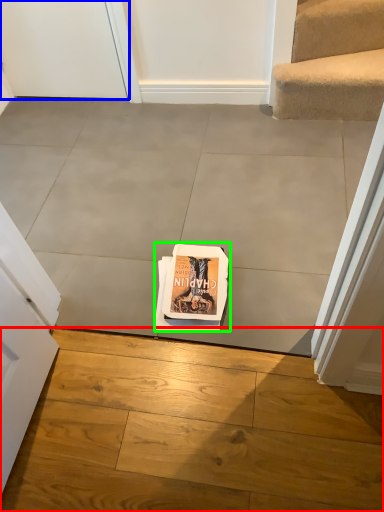
Question: Estimate the real-world distances between objects in this image. Which object is closer to concrete (highlighted by a red box), door (highlighted by a blue box) or paperback book (highlighted by a green box)?

Choices:
 (A) door
 (B) paperback book

Answer: (B)